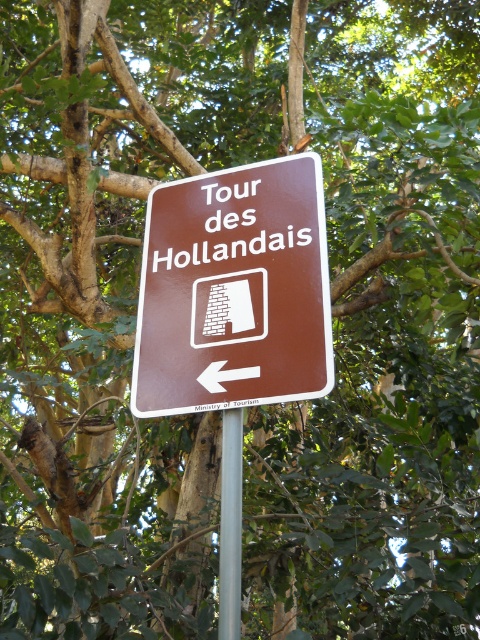
Between brown matte sign at center and silver metallic pole at center, which one appears on the left side from the viewer's perspective?

brown matte sign at center is more to the left.

Which is behind, point (299, 310) or point (229, 524)?

Point (299, 310)

At what (x,y) coordinates should I click in order to perform the action: click on brown matte sign at center. Please return your answer as a coordinate pair (x, y). This screenshot has height=640, width=480. Looking at the image, I should click on coord(233,291).